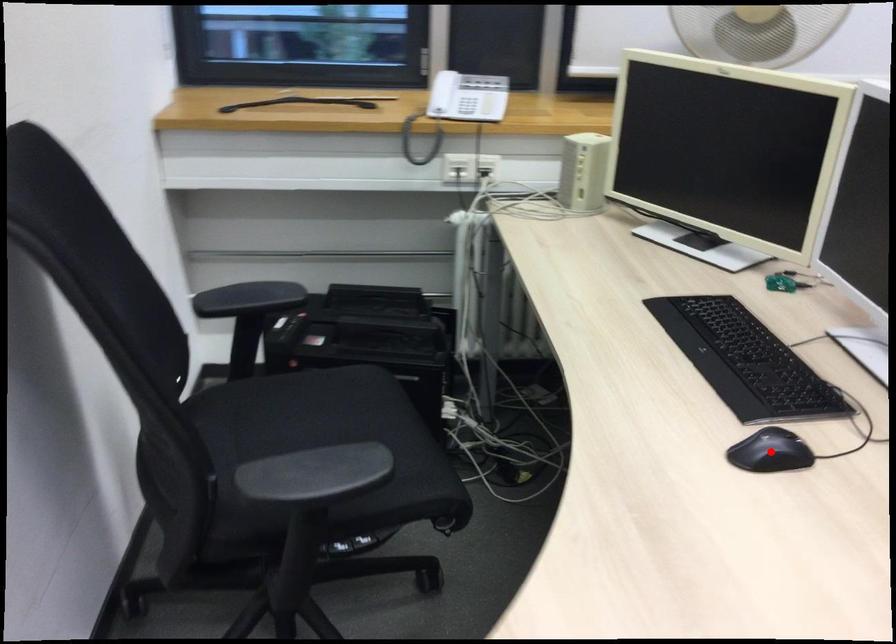
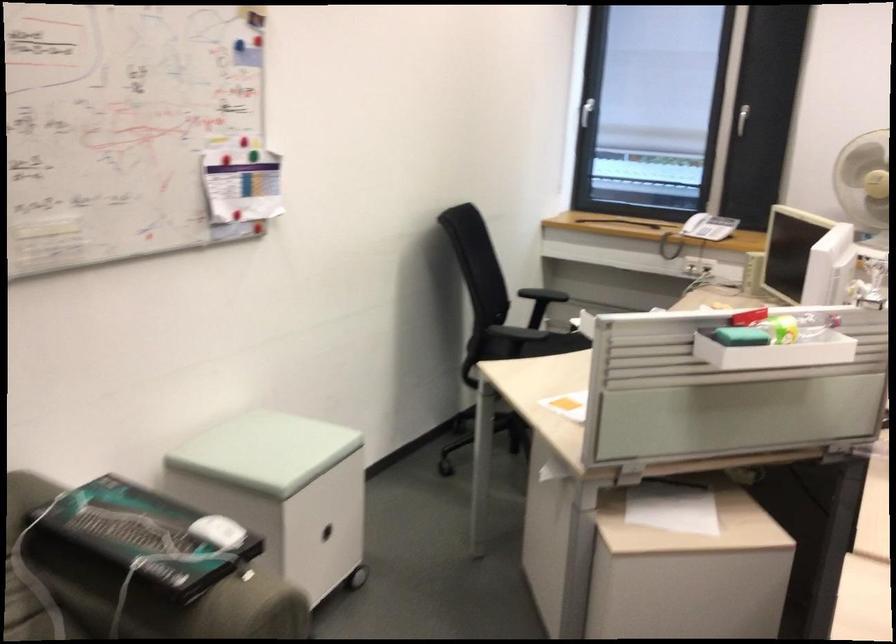
Question: I am providing you with two images of the same scene from different viewpoints. A red point is marked on the first image. Is the red point's position out of view in image 2?

Choices:
 (A) Yes
 (B) No

Answer: (A)